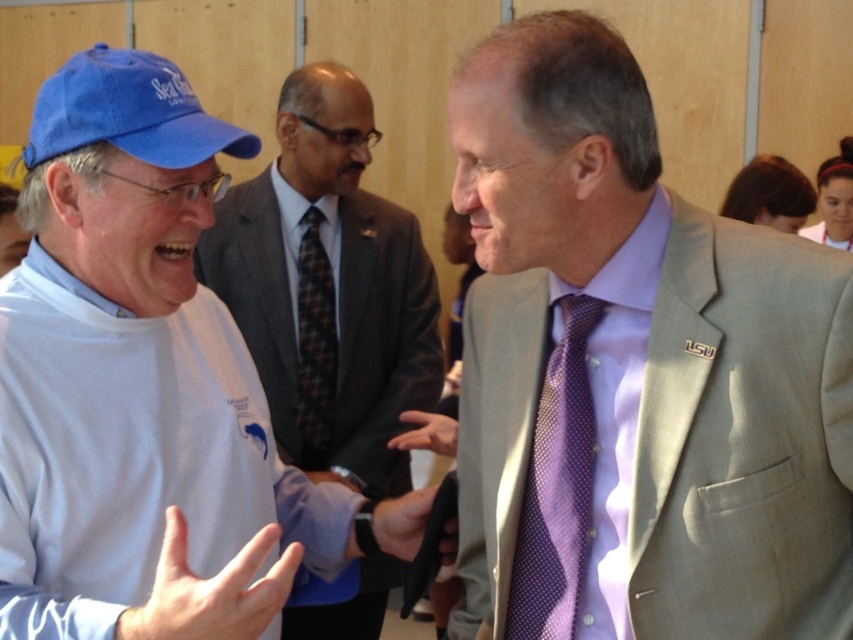
Question: Is white cotton t-shirt at left below purple dotted tie at right?

Choices:
 (A) yes
 (B) no

Answer: (B)

Question: Does purple dotted tie at right come in front of blue fabric baseball cap at left?

Choices:
 (A) no
 (B) yes

Answer: (A)

Question: Is blue fabric baseball cap at left bigger than plaid fabric tie at center?

Choices:
 (A) no
 (B) yes

Answer: (B)

Question: Among these objects, which one is farthest from the camera?

Choices:
 (A) blue fabric baseball cap at left
 (B) plaid fabric tie at center
 (C) purple dotted tie at right
 (D) purple silk tie at center

Answer: (B)

Question: Which is nearer to the white cotton t-shirt at left?

Choices:
 (A) purple dotted tie at right
 (B) blue fabric baseball cap at left
 (C) plaid fabric tie at center
 (D) purple silk tie at center

Answer: (C)

Question: Considering the real-world distances, which object is farthest from the purple dotted tie at right?

Choices:
 (A) plaid fabric tie at center
 (B) blue fabric baseball cap at left

Answer: (A)